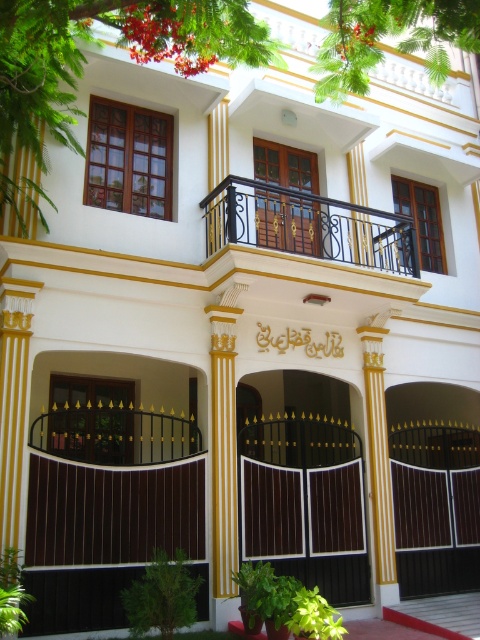
Based on the photo, does dark brown wooden gate at center have a greater width compared to yellow painted wood column at center?

Correct, the width of dark brown wooden gate at center exceeds that of yellow painted wood column at center.

Who is lower down, dark brown wooden gate at center or yellow painted wood column at center?

Positioned lower is dark brown wooden gate at center.

Does point (337, 492) lie in front of point (376, 604)?

No, (337, 492) is further to viewer.

Locate an element on the screen. The width and height of the screenshot is (480, 640). dark brown wooden gate at center is located at coordinates (307, 502).

Is point (257, 212) closer to viewer compared to point (297, 161)?

Yes, point (257, 212) is in front of point (297, 161).

Who is more distant from viewer, (x=233, y=205) or (x=299, y=244)?

Positioned behind is point (x=299, y=244).

At what (x,y) coordinates should I click in order to perform the action: click on black wrought iron balcony at upper center. Please return your answer as a coordinate pair (x, y). Looking at the image, I should click on (308, 225).

I want to click on dark brown wooden gate at center, so click(x=307, y=502).

Which of these two, dark brown wooden gate at center or wooden door at center, stands taller?

Standing taller between the two is dark brown wooden gate at center.

Who is more forward, (266, 440) or (268, 195)?

Positioned in front is point (268, 195).

You are a GUI agent. You are given a task and a screenshot of the screen. Output one action in this format:
    pyautogui.click(x=<x>, y=<y>)
    Task: Click on the dark brown wooden gate at center
    The image size is (480, 640).
    Given the screenshot: What is the action you would take?
    pyautogui.click(x=307, y=502)